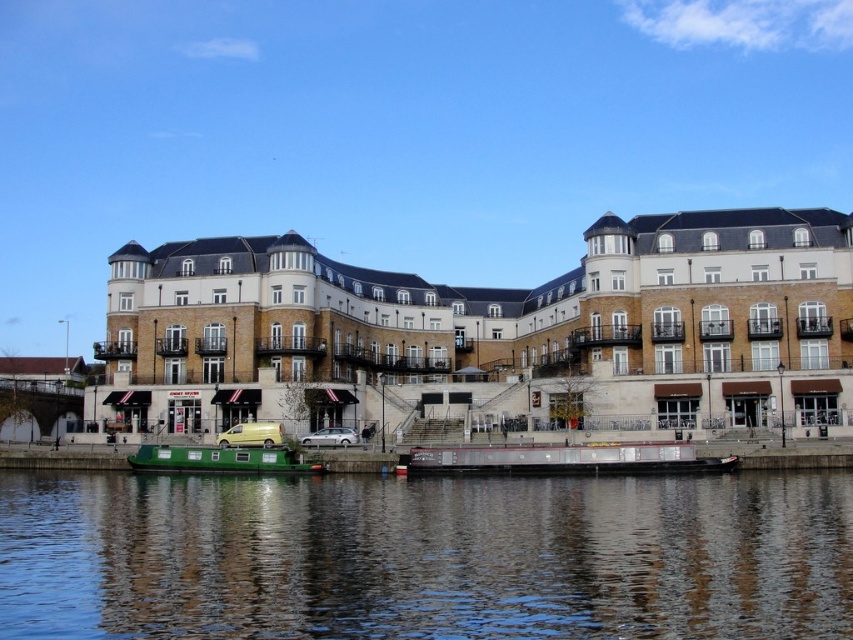
Question: Which point is closer to the camera taking this photo?

Choices:
 (A) (245, 432)
 (B) (642, 461)

Answer: (B)

Question: Is green matte boat at lower center thinner than white stone building at center?

Choices:
 (A) no
 (B) yes

Answer: (B)

Question: Which of these objects is positioned farthest from the white stone building at center?

Choices:
 (A) green matte boat at lower center
 (B) green painted wooden barge at center
 (C) metallic yellow van at center
 (D) green matte boat at lower left

Answer: (A)

Question: Does green matte boat at lower left come in front of metallic yellow van at center?

Choices:
 (A) no
 (B) yes

Answer: (B)

Question: Does green matte boat at lower center lie in front of green painted wooden barge at center?

Choices:
 (A) yes
 (B) no

Answer: (A)

Question: Which of these objects is positioned farthest from the green painted wooden barge at center?

Choices:
 (A) metallic yellow van at center
 (B) green matte boat at lower center
 (C) white stone building at center
 (D) green matte boat at lower left

Answer: (C)